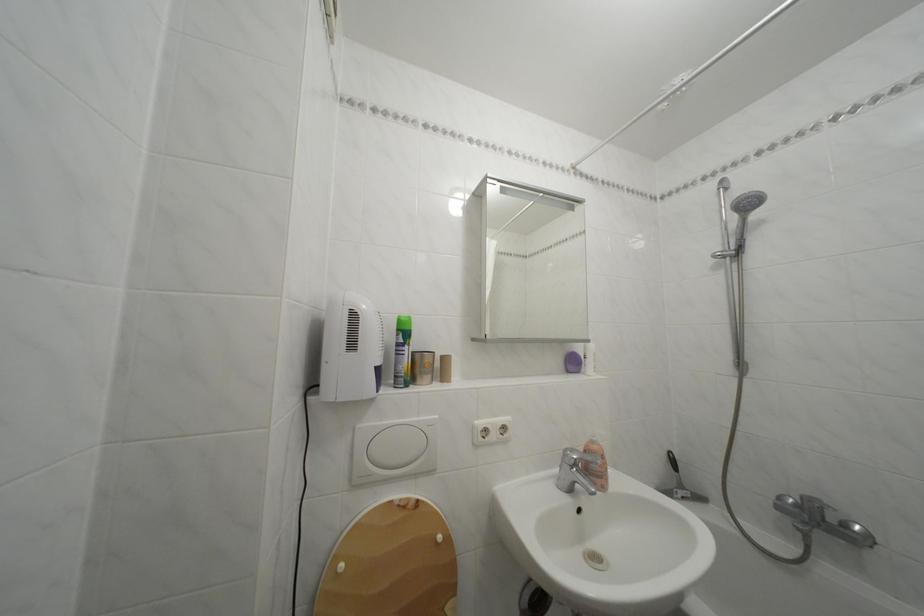
Which object does [391,564] point to?

This point indicates the wooden toilet lid.